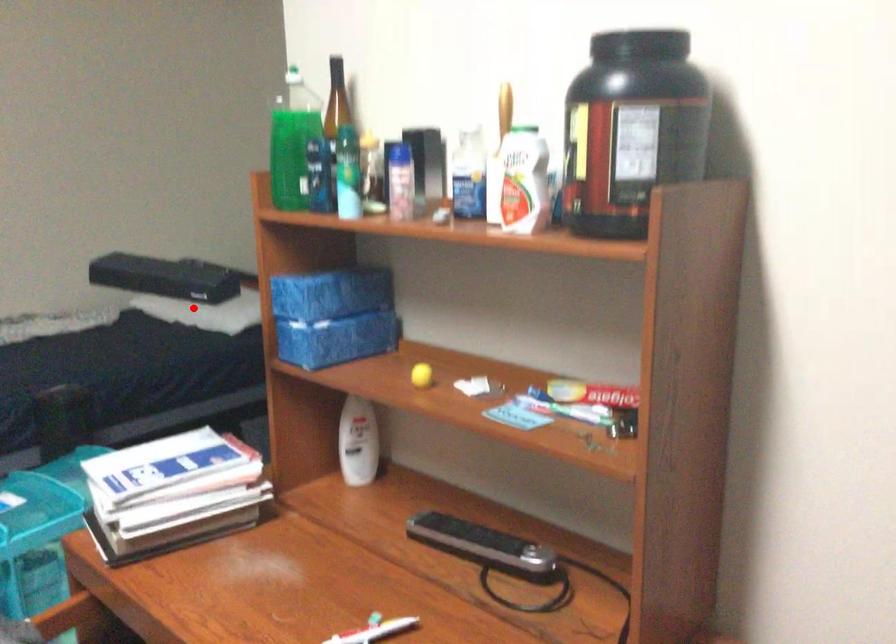
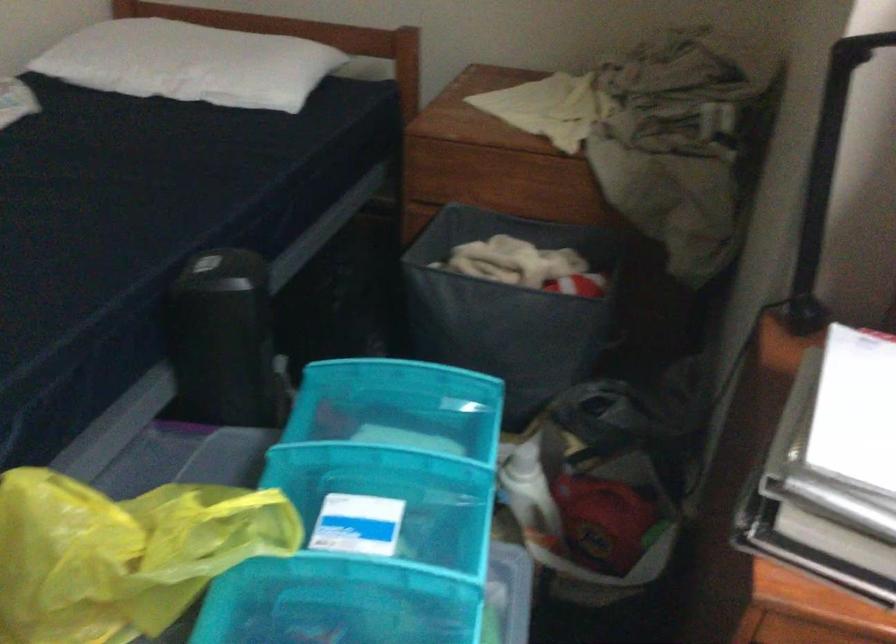
Where in the second image is the point corresponding to the highlighted location from the first image?

(191, 62)